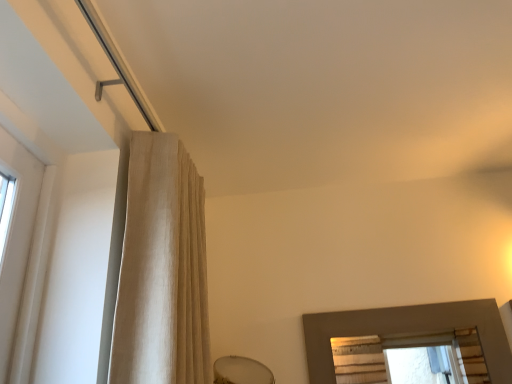
Locate an element on the screen. Image resolution: width=512 pixels, height=384 pixels. beige fabric curtain at left is located at coordinates (162, 269).

Describe the element at coordinates (162, 269) in the screenshot. I see `beige fabric curtain at left` at that location.

Measure the distance between beige fabric curtain at left and camera.

The distance of beige fabric curtain at left from camera is 3.34 feet.

Measure the distance between point (194, 379) and camera.

Point (194, 379) is 3.99 feet away from camera.

Image resolution: width=512 pixels, height=384 pixels. In order to click on beige fabric curtain at left in this screenshot , I will do `click(162, 269)`.